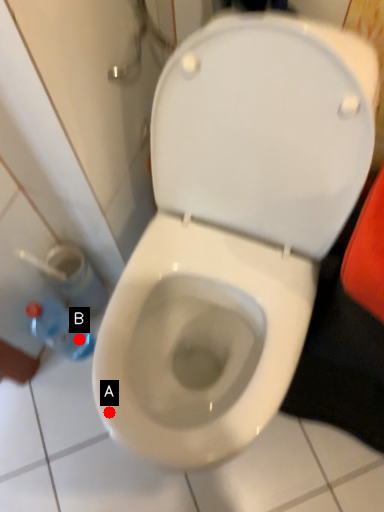
Question: Two points are circled on the image, labeled by A and B beside each circle. Which point is farther to the camera?

Choices:
 (A) A is further
 (B) B is further

Answer: (B)